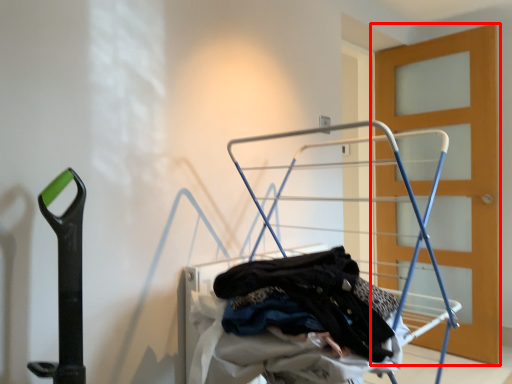
Question: From the image's perspective, considering the relative positions of door (annotated by the red box) and baby carriage in the image provided, where is door (annotated by the red box) located with respect to the staircase?

Choices:
 (A) above
 (B) below

Answer: (A)